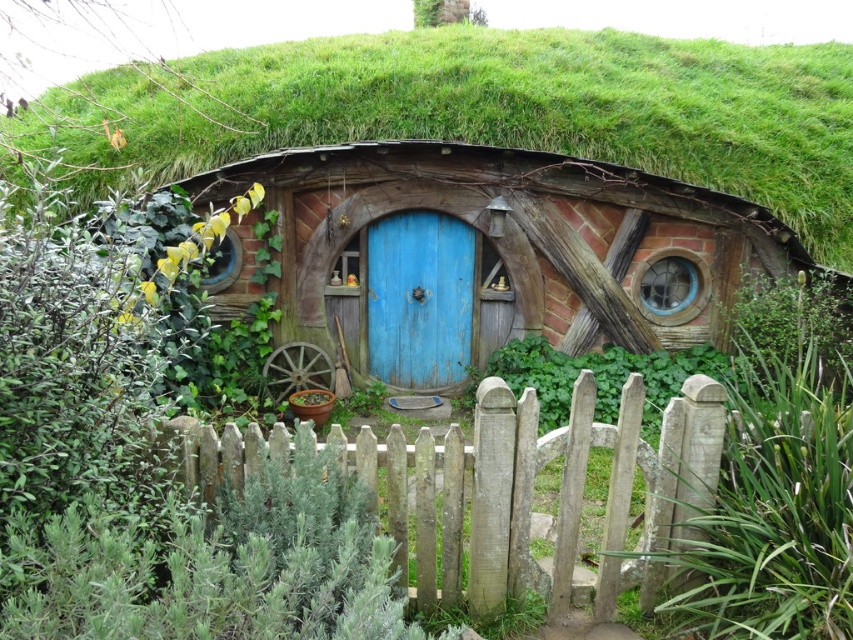
Question: Which point appears farthest from the camera in this image?

Choices:
 (A) pyautogui.click(x=405, y=333)
 (B) pyautogui.click(x=608, y=93)
 (C) pyautogui.click(x=428, y=298)

Answer: (B)

Question: Is wooden door at center to the left of green grass at center from the viewer's perspective?

Choices:
 (A) no
 (B) yes

Answer: (A)

Question: Is green grass at center thinner than weathered wood fence at center?

Choices:
 (A) no
 (B) yes

Answer: (A)

Question: Which object is the closest to the wooden door at center?

Choices:
 (A) green grass at center
 (B) blue wooden door at center
 (C) weathered wood fence at center

Answer: (B)

Question: Can you confirm if weathered wood fence at center is wider than blue wooden door at center?

Choices:
 (A) yes
 (B) no

Answer: (A)

Question: Among these points, which one is nearest to the camera?

Choices:
 (A) (514, 497)
 (B) (328, 364)

Answer: (A)